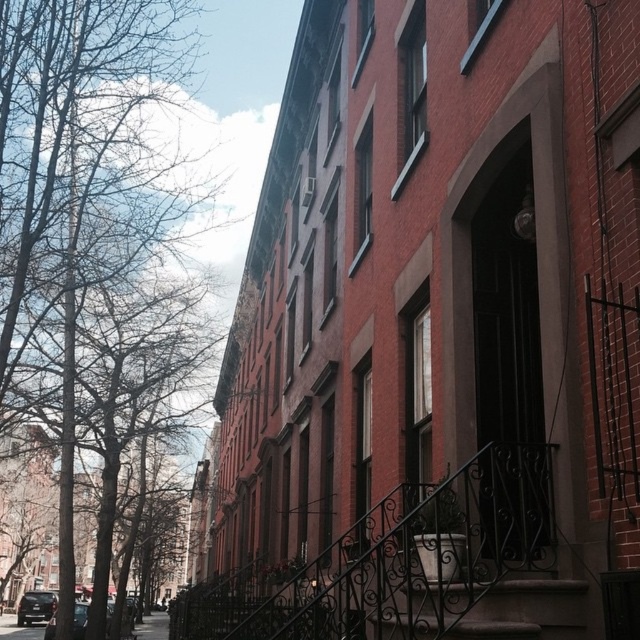
Does bare branches at upper left lie in front of concrete pavement at lower left?

Yes.

Does bare branches at upper left appear on the left side of concrete pavement at lower left?

Incorrect, bare branches at upper left is not on the left side of concrete pavement at lower left.

I want to click on bare branches at upper left, so click(81, 189).

The width and height of the screenshot is (640, 640). Identify the location of bare branches at upper left. (81, 189).

Does bare branches at upper left have a lesser height compared to dark brown wrought iron stairs at center?

In fact, bare branches at upper left may be taller than dark brown wrought iron stairs at center.

Does bare branches at upper left appear on the left side of dark brown wrought iron stairs at center?

→ Indeed, bare branches at upper left is positioned on the left side of dark brown wrought iron stairs at center.

Identify the location of bare branches at upper left. (81, 189).

Does dark brown wrought iron stairs at center have a greater width compared to concrete pavement at lower left?

Incorrect, dark brown wrought iron stairs at center's width does not surpass concrete pavement at lower left's.

Between point (536, 609) and point (163, 637), which one is positioned behind?

The point (163, 637) is behind.

Find the location of a particular element. dark brown wrought iron stairs at center is located at coordinates (500, 612).